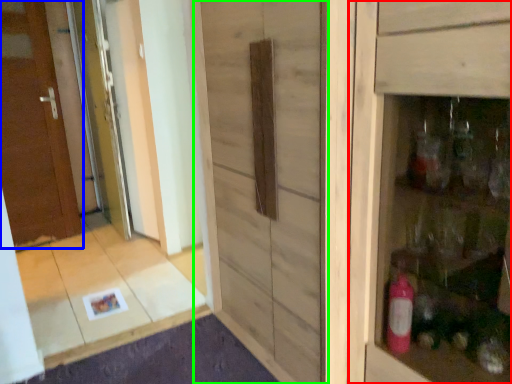
Question: Which object is the farthest from cabinetry (highlighted by a red box)? Choose among these: door (highlighted by a blue box) or barn door (highlighted by a green box).

Choices:
 (A) door
 (B) barn door

Answer: (A)